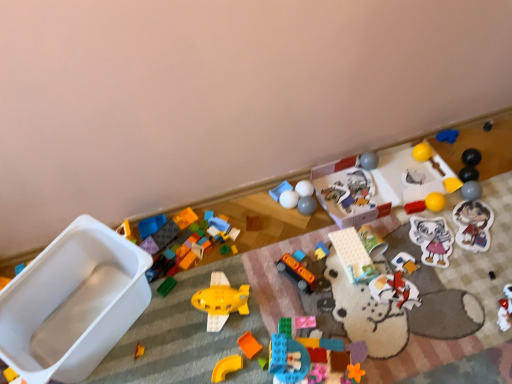
Find the location of a particular element. The width and height of the screenshot is (512, 384). free area in between yellow matte square at center-right, which is the 4th toy in right-to-left order, and orange plastic block at lower left, which is the third toy in left-to-right order is located at coordinates (323, 263).